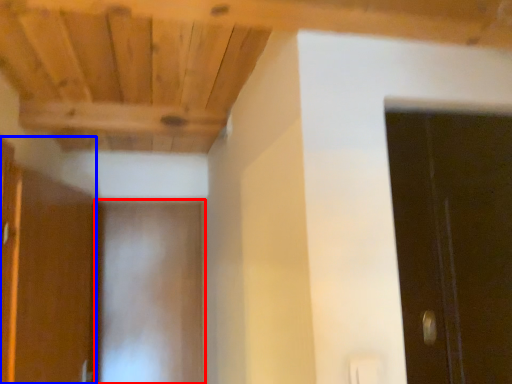
Question: Among these objects, which one is farthest to the camera, door (highlighted by a red box) or cabinetry (highlighted by a blue box)?

Choices:
 (A) door
 (B) cabinetry

Answer: (A)